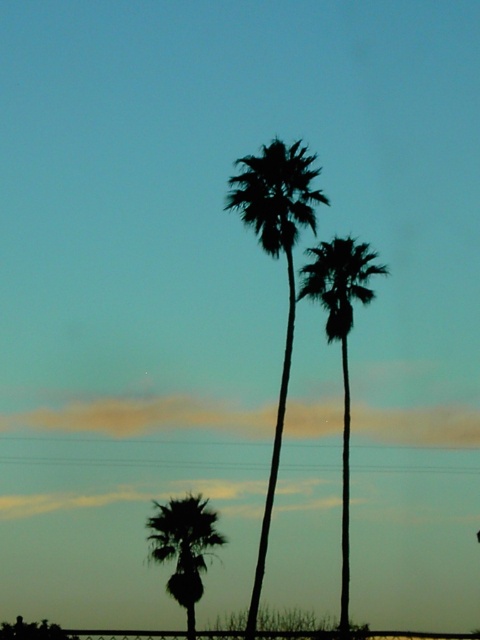
Question: Is silhouette palm at center bigger than silhouette palm at lower left?

Choices:
 (A) yes
 (B) no

Answer: (A)

Question: Which point is closer to the camera taking this photo?

Choices:
 (A) (257, 214)
 (B) (332, 253)
 (C) (164, 506)

Answer: (A)

Question: Does silhouette leafy palm at center have a larger size compared to silhouette palm at center?

Choices:
 (A) no
 (B) yes

Answer: (A)

Question: Which point is closer to the camera taking this photo?

Choices:
 (A) (308, 196)
 (B) (188, 563)

Answer: (A)

Question: Which object is positioned farthest from the silhouette palm at lower left?

Choices:
 (A) silhouette palm at center
 (B) silhouette leafy palm at center

Answer: (B)

Question: Where is silhouette leafy palm at center located in relation to silhouette palm at lower left in the image?

Choices:
 (A) left
 (B) right

Answer: (B)